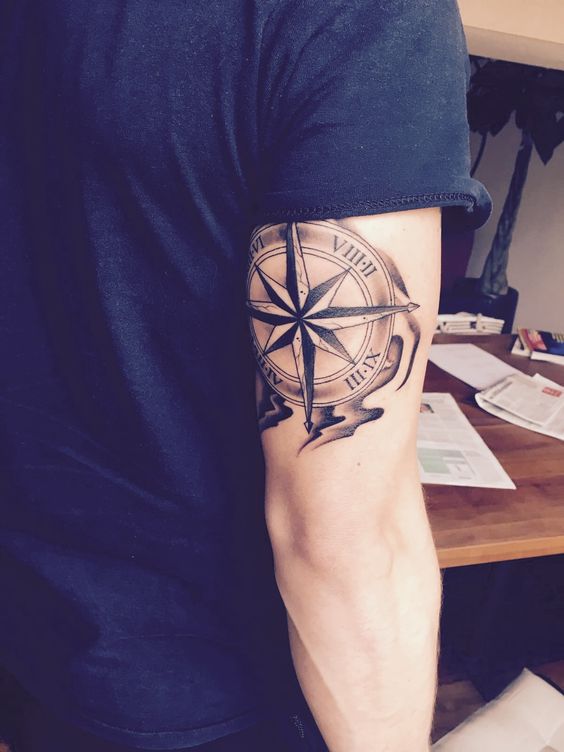
Locate an element on the screen. wood desk is located at coordinates (511, 544).